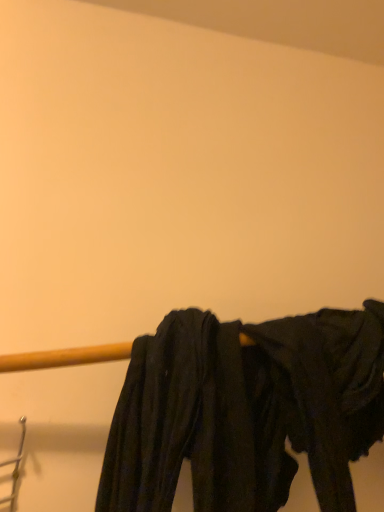
This screenshot has height=512, width=384. What do you see at coordinates (246, 410) in the screenshot?
I see `black cotton pants at center` at bounding box center [246, 410].

You are a GUI agent. You are given a task and a screenshot of the screen. Output one action in this format:
    pyautogui.click(x=<x>, y=<y>)
    Task: Click on the black cotton pants at center
    The image size is (384, 512).
    Given the screenshot: What is the action you would take?
    pyautogui.click(x=246, y=410)

I want to click on black cotton pants at center, so click(246, 410).